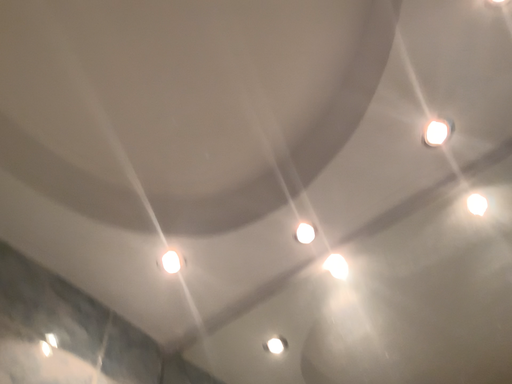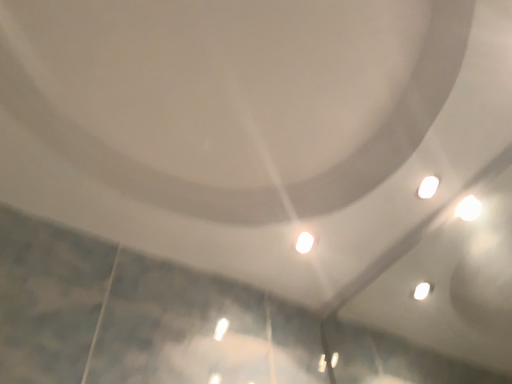
Question: Which way did the camera rotate in the video?

Choices:
 (A) rotated downward
 (B) rotated upward

Answer: (A)